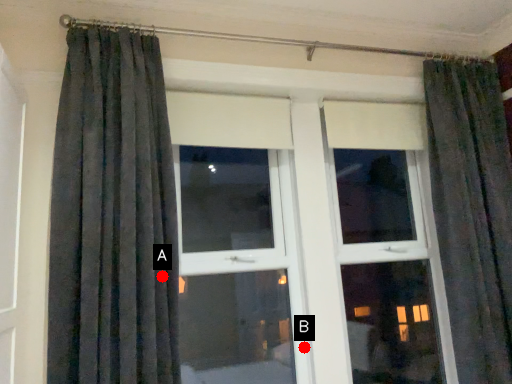
Question: Two points are circled on the image, labeled by A and B beside each circle. Which of the following is the closest to the observer?

Choices:
 (A) A is closer
 (B) B is closer

Answer: (A)